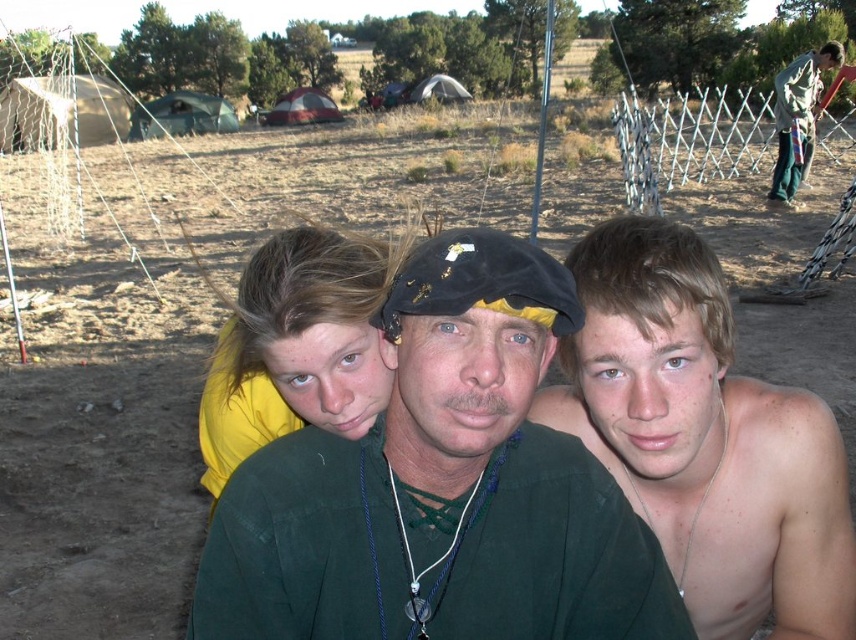
Question: Does shiny silver necklace at center appear under green fabric pants at right?

Choices:
 (A) yes
 (B) no

Answer: (A)

Question: Can you confirm if green fabric shirt at center is positioned to the left of yellow fabric at center?

Choices:
 (A) yes
 (B) no

Answer: (B)

Question: Considering the real-world distances, which object is farthest from the shiny silver necklace at center?

Choices:
 (A) green fabric shirt at center
 (B) yellow fabric at center
 (C) green fabric pants at right

Answer: (C)

Question: Can you confirm if green fabric shirt at center is positioned below yellow fabric at center?

Choices:
 (A) yes
 (B) no

Answer: (A)

Question: Which of the following is the farthest from the observer?

Choices:
 (A) green fabric shirt at center
 (B) yellow fabric at center

Answer: (B)

Question: Which object is the farthest from the shiny silver necklace at center?

Choices:
 (A) green fabric shirt at center
 (B) yellow fabric at center

Answer: (B)